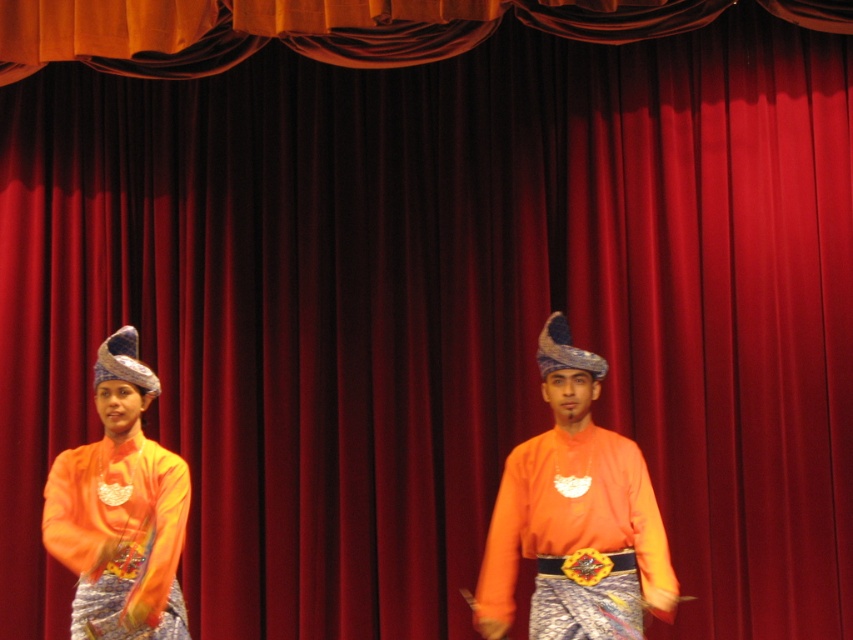
Can you confirm if orange matte shirt at center is positioned below matte orange fabric at left?

Actually, orange matte shirt at center is above matte orange fabric at left.

Who is higher up, orange matte shirt at center or matte orange fabric at left?

orange matte shirt at center is above.

This screenshot has height=640, width=853. Find the location of `orange matte shirt at center`. orange matte shirt at center is located at coordinates (575, 516).